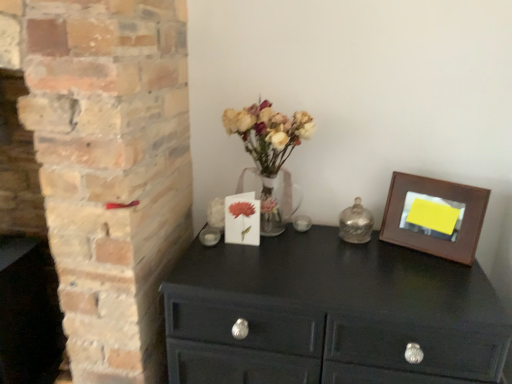
Identify the location of vacant space that's between translucent glass vase at center and shiny metallic bell at center-right. The image size is (512, 384). (325, 238).